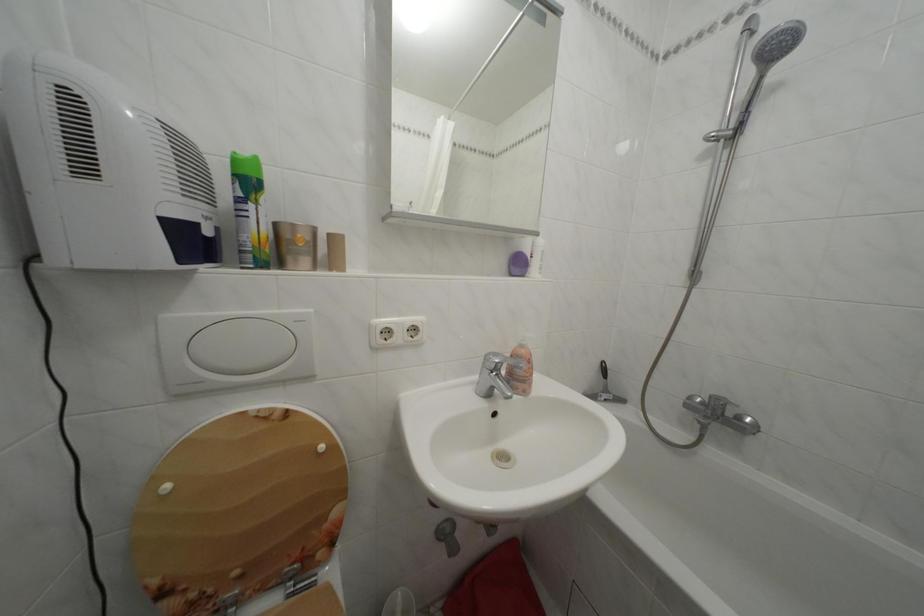
Locate an element on the screen. The width and height of the screenshot is (924, 616). sink faucet handle is located at coordinates (492, 376).